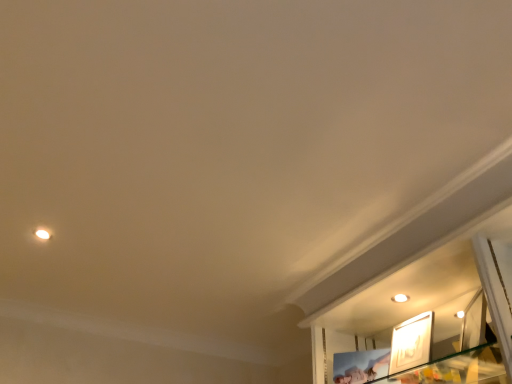
I want to click on white glossy picture frame at upper right, so click(x=411, y=343).

What do you see at coordinates (411, 343) in the screenshot?
I see `white glossy picture frame at upper right` at bounding box center [411, 343].

Identify the location of white glossy picture frame at upper right. (411, 343).